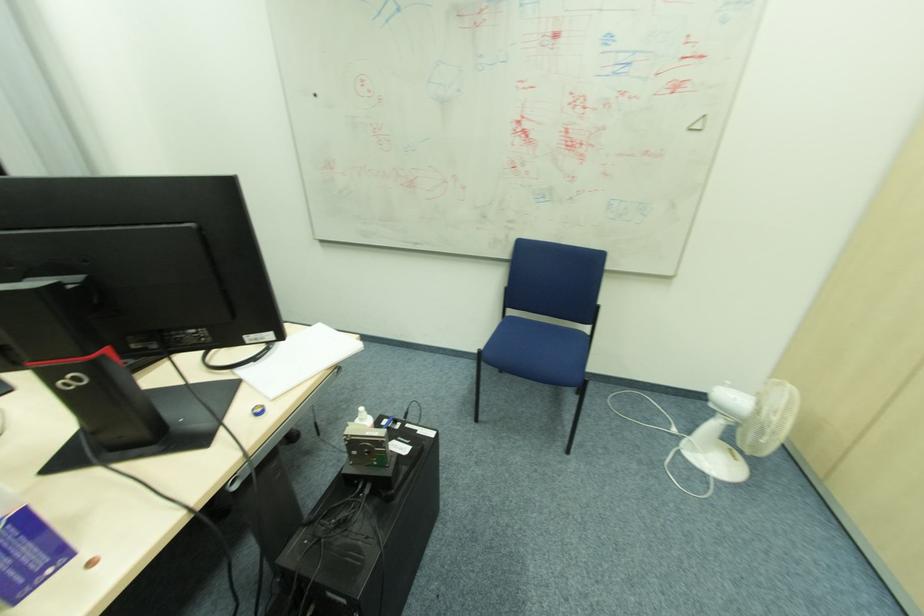
Locate an element on the screen. The width and height of the screenshot is (924, 616). chair sitting surface is located at coordinates (549, 341).